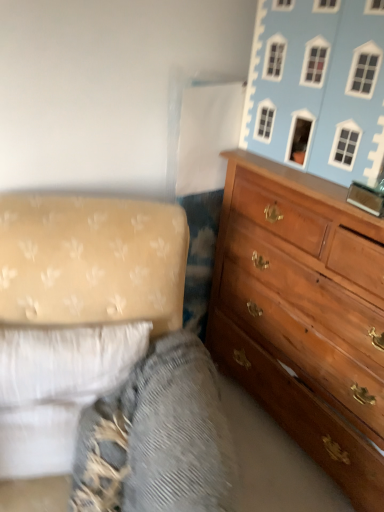
What is the approximate height of textured fabric at lower left?

The height of textured fabric at lower left is 16.83 inches.

Identify the location of textured fabric at lower left. (158, 438).

Can we say light blue painted wood dollhouse at upper right lies outside white fabric studio couch at lower left?

Absolutely, light blue painted wood dollhouse at upper right is external to white fabric studio couch at lower left.

From a real-world perspective, which is physically below, light blue painted wood dollhouse at upper right or white fabric studio couch at lower left?

white fabric studio couch at lower left, from a real-world perspective.

In the scene shown: Can you tell me how much light blue painted wood dollhouse at upper right and white fabric studio couch at lower left differ in facing direction?

The facing directions of light blue painted wood dollhouse at upper right and white fabric studio couch at lower left are 60.7 degrees apart.

Between white fabric studio couch at lower left and textured fabric at lower left, which one has smaller size?

white fabric studio couch at lower left is smaller.

Can textured fabric at lower left be found inside white fabric studio couch at lower left?

That's incorrect, textured fabric at lower left is not inside white fabric studio couch at lower left.

From the image's perspective, is white fabric studio couch at lower left located above textured fabric at lower left?

Yes, from the image's perspective, white fabric studio couch at lower left is on top of textured fabric at lower left.

At what (x,y) coordinates should I click in order to perform the action: click on studio couch on the left of textured fabric at lower left. Please return your answer as a coordinate pair (x, y). The height and width of the screenshot is (512, 384). Looking at the image, I should click on (77, 312).

Is wooden dresser at right wider than white fabric studio couch at lower left?

Yes, wooden dresser at right is wider than white fabric studio couch at lower left.

Does point (341, 406) come farther from viewer compared to point (92, 293)?

Yes, it is behind point (92, 293).

From a real-world perspective, which object rests below the other?

wooden dresser at right is physically lower.

Is textured fabric at lower left behind white fabric studio couch at lower left?

No, textured fabric at lower left is closer to the viewer.

From a real-world perspective, is textured fabric at lower left positioned above or below white fabric studio couch at lower left?

textured fabric at lower left is below white fabric studio couch at lower left.

In the scene shown: Which is more to the right, textured fabric at lower left or white fabric studio couch at lower left?

textured fabric at lower left.

Can you confirm if textured fabric at lower left is wider than white fabric studio couch at lower left?

Yes.

Does light blue painted wood dollhouse at upper right come behind textured fabric at lower left?

Yes, it is behind textured fabric at lower left.

How many degrees apart are the facing directions of light blue painted wood dollhouse at upper right and textured fabric at lower left?

The angular difference between light blue painted wood dollhouse at upper right and textured fabric at lower left is 60.6 degrees.

Consider the image. Is light blue painted wood dollhouse at upper right aimed at textured fabric at lower left?

No.

From the picture: Is light blue painted wood dollhouse at upper right with textured fabric at lower left?

No, light blue painted wood dollhouse at upper right is not beside textured fabric at lower left.

Considering the sizes of objects wooden dresser at right and light blue painted wood dollhouse at upper right in the image provided, who is thinner, wooden dresser at right or light blue painted wood dollhouse at upper right?

With smaller width is light blue painted wood dollhouse at upper right.

Is wooden dresser at right turned away from light blue painted wood dollhouse at upper right?

No, wooden dresser at right is not facing the opposite direction of light blue painted wood dollhouse at upper right.

Is wooden dresser at right placed right next to light blue painted wood dollhouse at upper right?

They are not placed beside each other.

Does wooden dresser at right lie behind light blue painted wood dollhouse at upper right?

No, wooden dresser at right is closer to the camera.

Looking at the image, does textured fabric at lower left seem bigger or smaller compared to wooden dresser at right?

In the image, textured fabric at lower left appears to be smaller than wooden dresser at right.

Between textured fabric at lower left and wooden dresser at right, which one has less height?

textured fabric at lower left is shorter.

From the image's perspective, which one is positioned higher, textured fabric at lower left or wooden dresser at right?

From the image's view, wooden dresser at right is above.

Locate an element on the screen. The height and width of the screenshot is (512, 384). gray lying below the wooden dresser at right (from the image's perspective) is located at coordinates (158, 438).

Image resolution: width=384 pixels, height=512 pixels. In order to click on studio couch that is under the light blue painted wood dollhouse at upper right (from a real-world perspective) in this screenshot , I will do `click(77, 312)`.

What are the coordinates of `gray in front of the white fabric studio couch at lower left` in the screenshot? It's located at tap(158, 438).

Considering their positions, is textured fabric at lower left positioned further to light blue painted wood dollhouse at upper right than wooden dresser at right?

Among the two, textured fabric at lower left is located further to light blue painted wood dollhouse at upper right.

Looking at the image, which one is located closer to light blue painted wood dollhouse at upper right, white fabric studio couch at lower left or wooden dresser at right?

wooden dresser at right is closer to light blue painted wood dollhouse at upper right.

From the image, which object appears to be farther from white fabric studio couch at lower left, textured fabric at lower left or light blue painted wood dollhouse at upper right?

The object further to white fabric studio couch at lower left is light blue painted wood dollhouse at upper right.

Considering their positions, is wooden dresser at right positioned closer to textured fabric at lower left than white fabric studio couch at lower left?

white fabric studio couch at lower left is positioned closer to the anchor textured fabric at lower left.

Estimate the real-world distances between objects in this image. Which object is further from white fabric studio couch at lower left, light blue painted wood dollhouse at upper right or wooden dresser at right?

light blue painted wood dollhouse at upper right.

Based on the photo, when comparing their distances from wooden dresser at right, does white fabric studio couch at lower left or light blue painted wood dollhouse at upper right seem further?

white fabric studio couch at lower left.

Based on the photo, from the image, which object appears to be farther from light blue painted wood dollhouse at upper right, white fabric studio couch at lower left or textured fabric at lower left?

Among the two, textured fabric at lower left is located further to light blue painted wood dollhouse at upper right.

Considering their positions, is wooden dresser at right positioned closer to textured fabric at lower left than light blue painted wood dollhouse at upper right?

wooden dresser at right lies closer to textured fabric at lower left than the other object.

I want to click on the chest of drawers between light blue painted wood dollhouse at upper right and white fabric studio couch at lower left vertically, so click(304, 315).

Locate an element on the screen. This screenshot has height=512, width=384. gray between white fabric studio couch at lower left and wooden dresser at right from left to right is located at coordinates (158, 438).

This screenshot has width=384, height=512. Find the location of `studio couch between light blue painted wood dollhouse at upper right and textured fabric at lower left from top to bottom`. studio couch between light blue painted wood dollhouse at upper right and textured fabric at lower left from top to bottom is located at coordinates (77, 312).

You are a GUI agent. You are given a task and a screenshot of the screen. Output one action in this format:
    pyautogui.click(x=<x>, y=<y>)
    Task: Click on the chest of drawers between light blue painted wood dollhouse at upper right and textured fabric at lower left from top to bottom
    The width and height of the screenshot is (384, 512).
    Given the screenshot: What is the action you would take?
    pyautogui.click(x=304, y=315)